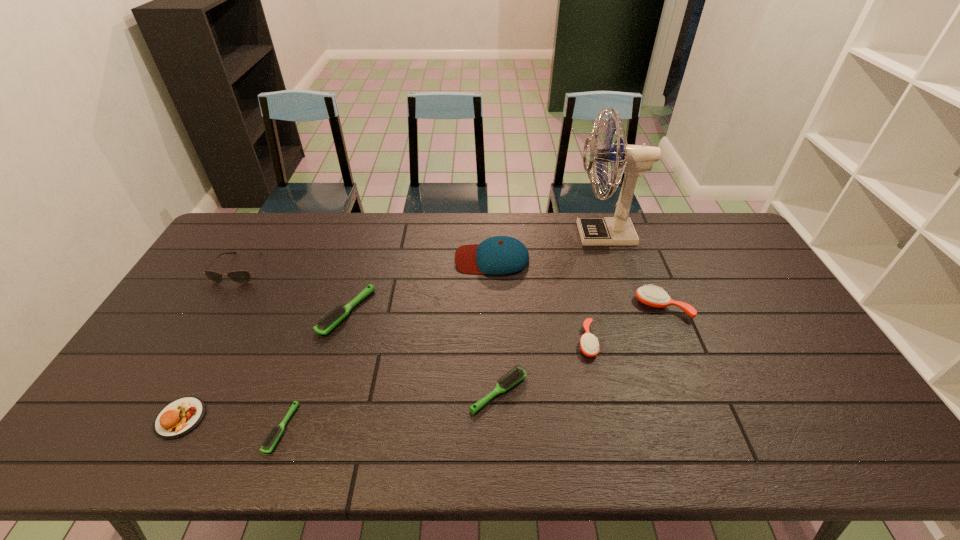
What are the coordinates of `vacant space located on the front-facing side of the sunglasses` in the screenshot? It's located at (167, 390).

Locate an element on the screen. blank area located 0.330m on the back of the bigger orange hairbrush is located at coordinates (631, 230).

Identify the location of vacant space situated on the right of the farthest light hairbrush. The image size is (960, 540). (418, 312).

Find the location of a particular element. free space located on the right of the third object from right to left is located at coordinates (660, 341).

Where is `free region located on the right of the patty (food)`? The height and width of the screenshot is (540, 960). free region located on the right of the patty (food) is located at coordinates (335, 418).

This screenshot has width=960, height=540. What are the coordinates of `free space located on the right of the rightmost light hairbrush` in the screenshot? It's located at (680, 392).

Locate an element on the screen. The width and height of the screenshot is (960, 540). vacant space located on the back of the shortest hairbrush is located at coordinates (310, 347).

Locate an element on the screen. Image resolution: width=960 pixels, height=540 pixels. fan that is at the far edge is located at coordinates (633, 160).

This screenshot has width=960, height=540. Identify the location of baseball cap that is at the far edge. (499, 255).

Where is `patty (food) present at the near edge`? Image resolution: width=960 pixels, height=540 pixels. patty (food) present at the near edge is located at coordinates (179, 417).